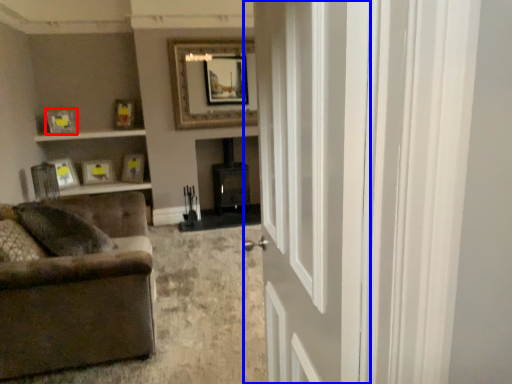
Question: Which point is closer to the camera, picture frame (highlighted by a red box) or door (highlighted by a blue box)?

Choices:
 (A) picture frame
 (B) door

Answer: (B)